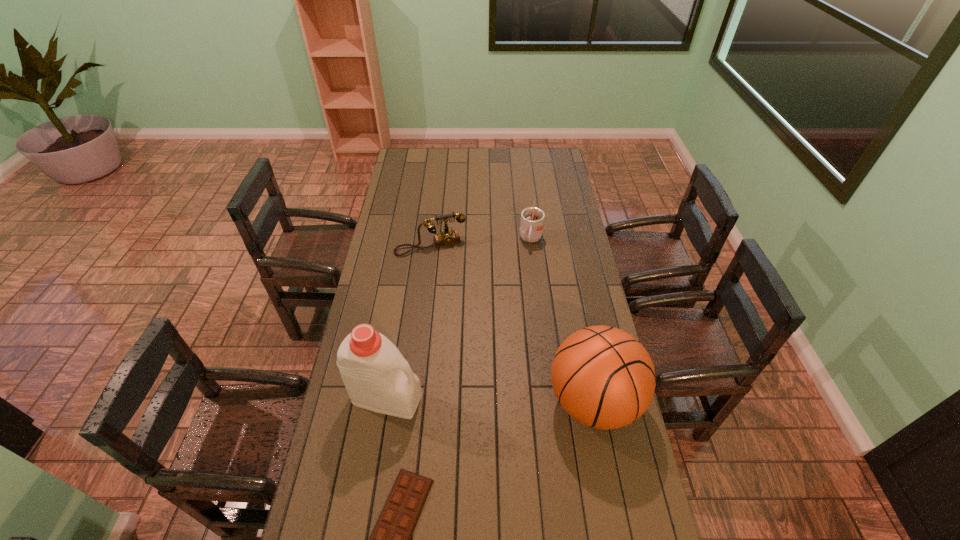
Locate an element on the screen. vacant region located on the side with the handle of the cup is located at coordinates (522, 300).

Identify the location of vacant space located 0.090m on the handle side of the detergent. (446, 411).

You are a GUI agent. You are given a task and a screenshot of the screen. Output one action in this format:
    pyautogui.click(x=<x>, y=<y>)
    Task: Click on the vacant region located on the handle side of the detergent
    Image resolution: width=960 pixels, height=540 pixels.
    Given the screenshot: What is the action you would take?
    pyautogui.click(x=511, y=428)

This screenshot has width=960, height=540. What are the coordinates of `free space located on the handle side of the detergent` in the screenshot? It's located at (505, 427).

The width and height of the screenshot is (960, 540). Find the location of `telephone present at the left edge`. telephone present at the left edge is located at coordinates (447, 237).

The width and height of the screenshot is (960, 540). Identify the location of detergent that is at the left edge. (377, 377).

What are the coordinates of `object present at the right edge` in the screenshot? It's located at (603, 377).

Find the location of a particular element. vacant space at the near edge of the desktop is located at coordinates (487, 501).

Locate an element on the screen. vacant point at the left edge is located at coordinates (324, 492).

Where is `blank space at the right edge of the desktop`? blank space at the right edge of the desktop is located at coordinates (579, 289).